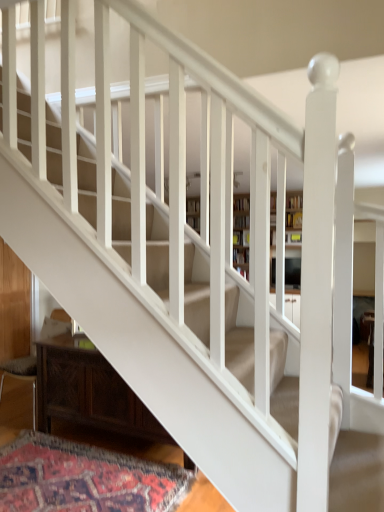
Question: In terms of width, does wooden bookcase at center look wider or thinner when compared to carpeted mat at lower left?

Choices:
 (A) wide
 (B) thin

Answer: (B)

Question: Is point (196, 207) closer or farther from the camera than point (185, 485)?

Choices:
 (A) closer
 (B) farther

Answer: (A)

Question: Which object is positioned farthest from the dark wood cabinet at lower left?

Choices:
 (A) wooden bookcase at center
 (B) wooden armchair at lower left
 (C) carpeted mat at lower left

Answer: (A)

Question: Based on their relative distances, which object is nearer to the carpeted mat at lower left?

Choices:
 (A) dark wood cabinet at lower left
 (B) wooden armchair at lower left
 (C) wooden bookcase at center

Answer: (A)